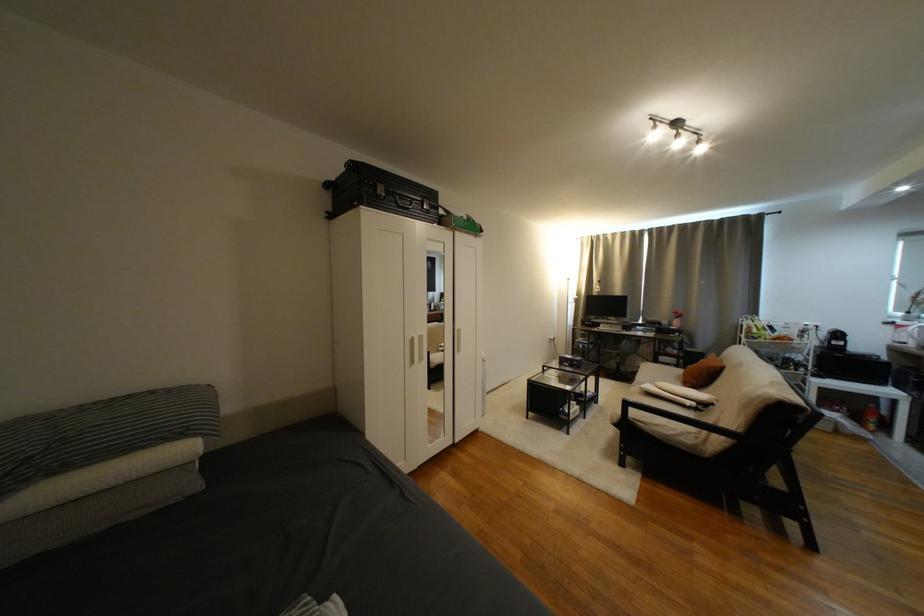
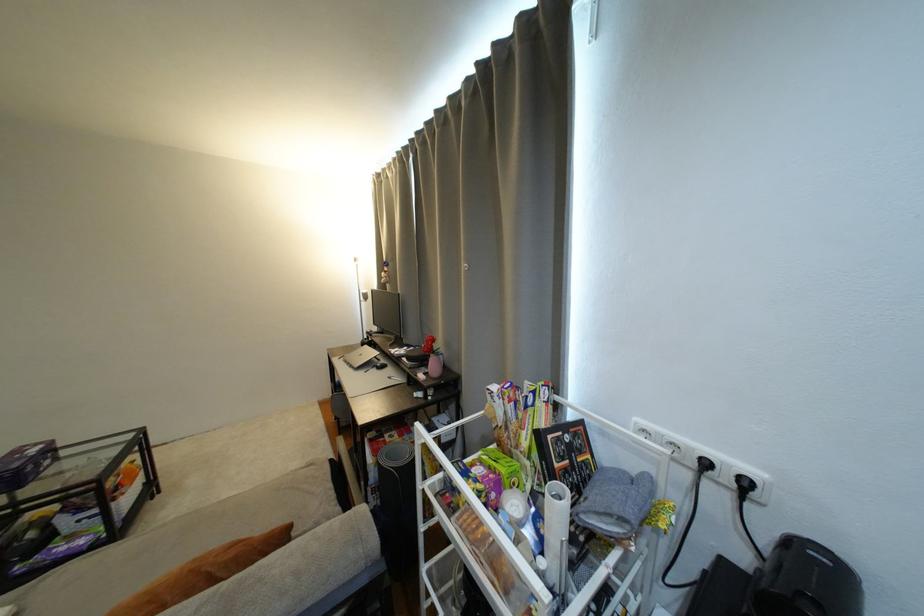
Where in the second image is the point corresponding to pixel 815 328 from the first image?

(714, 466)